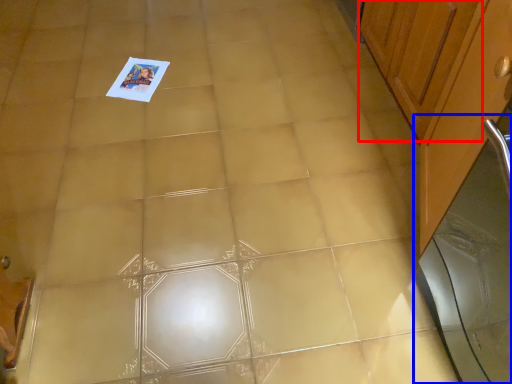
Question: Which object appears closest to the camera in this image, cabinetry (highlighted by a red box) or screen door (highlighted by a blue box)?

Choices:
 (A) cabinetry
 (B) screen door

Answer: (B)